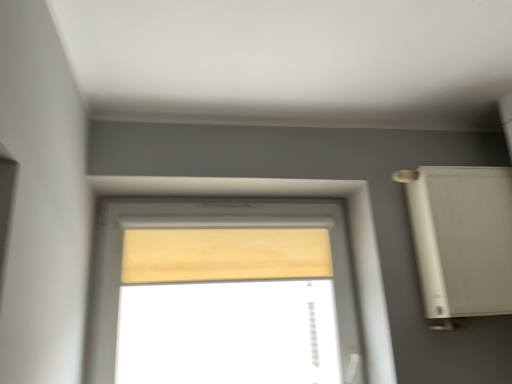
Question: Is point (425, 289) positioned closer to the camera than point (179, 342)?

Choices:
 (A) farther
 (B) closer

Answer: (B)

Question: Is white plastic air conditioner at right spatially inside wooden blind at center, or outside of it?

Choices:
 (A) inside
 (B) outside

Answer: (B)

Question: Which of these objects is positioned farthest from the white plastic air conditioner at right?

Choices:
 (A) wooden blind at center
 (B) beige fabric curtain at center

Answer: (A)

Question: Based on their relative distances, which object is farther from the wooden blind at center?

Choices:
 (A) white plastic air conditioner at right
 (B) beige fabric curtain at center

Answer: (A)